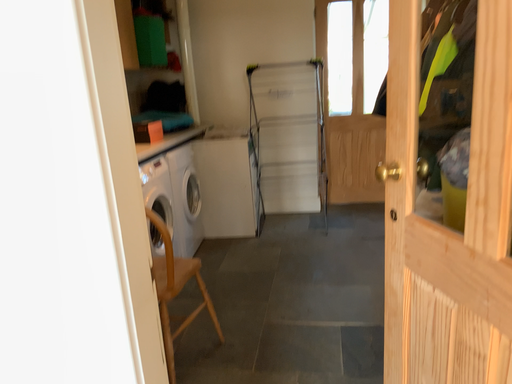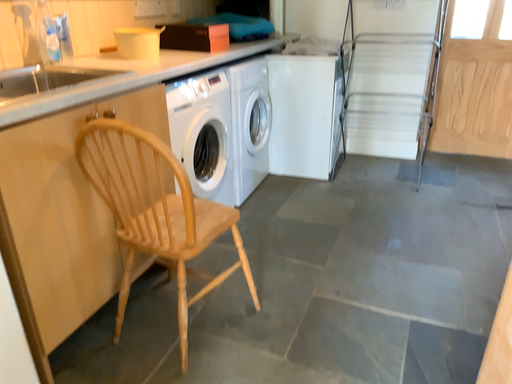
Question: How did the camera likely rotate when shooting the video?

Choices:
 (A) rotated upward
 (B) rotated downward

Answer: (B)